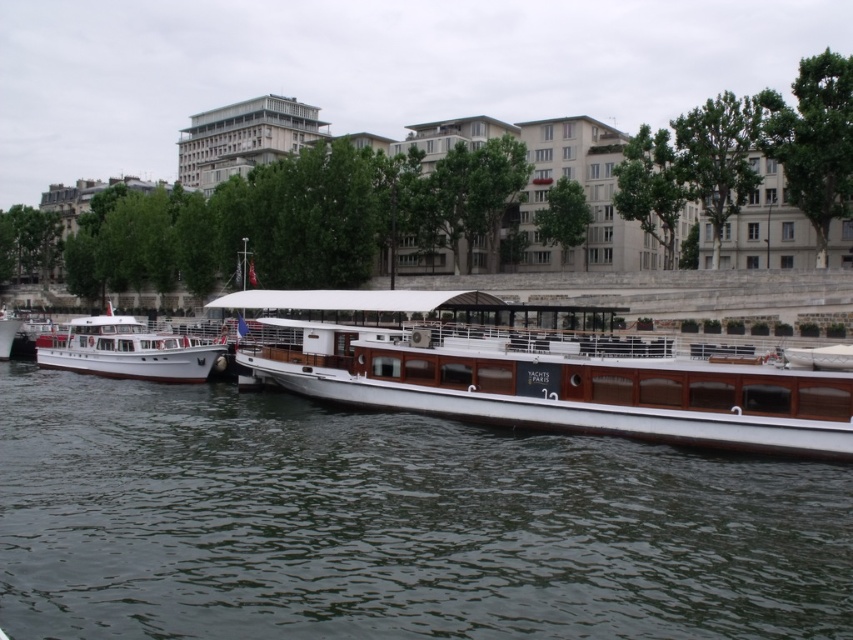
Question: Which point appears farthest from the camera in this image?

Choices:
 (A) (190, 365)
 (B) (0, 563)

Answer: (A)

Question: Does smooth dark water at center come in front of white matte boat at left?

Choices:
 (A) no
 (B) yes

Answer: (B)

Question: Does smooth dark water at center have a lesser width compared to white polished wood boat at center?

Choices:
 (A) yes
 (B) no

Answer: (B)

Question: Based on their relative distances, which object is farther from the smooth dark water at center?

Choices:
 (A) white matte boat at left
 (B) white polished wood boat at center

Answer: (A)

Question: Where is smooth dark water at center located in relation to white matte boat at left in the image?

Choices:
 (A) left
 (B) right

Answer: (B)

Question: Which of these objects is positioned closest to the white matte boat at left?

Choices:
 (A) white polished wood boat at center
 (B) smooth dark water at center

Answer: (A)